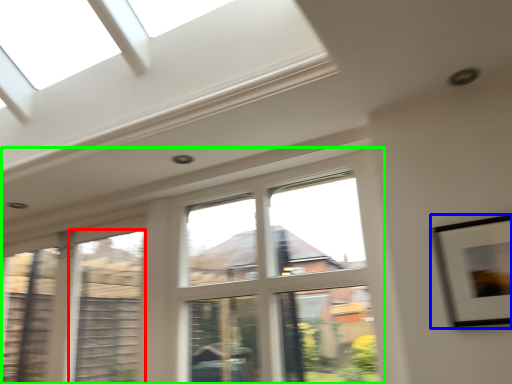
Question: Based on their relative distances, which object is farther from window (highlighted by a red box)? Choose from picture frame (highlighted by a blue box) and window (highlighted by a green box).

Choices:
 (A) picture frame
 (B) window

Answer: (A)